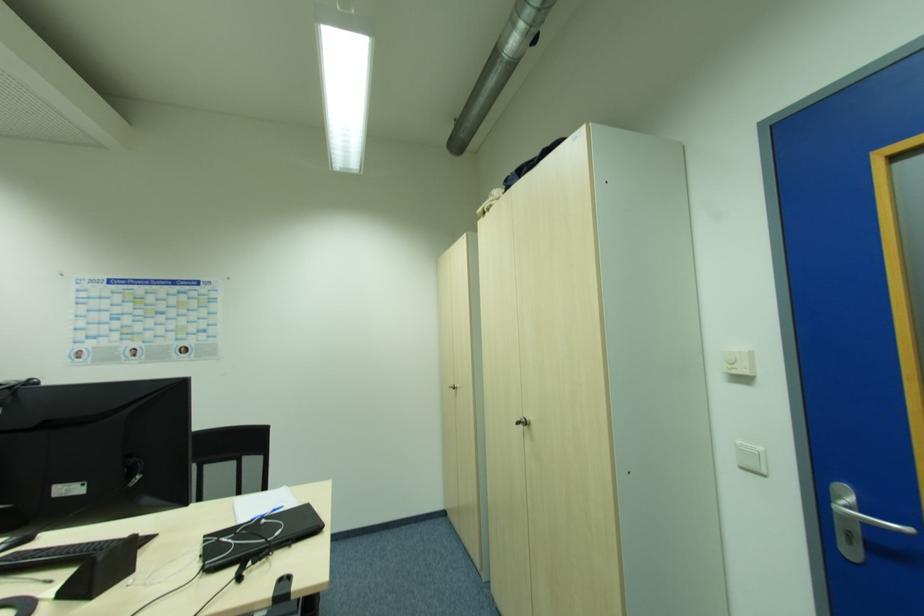
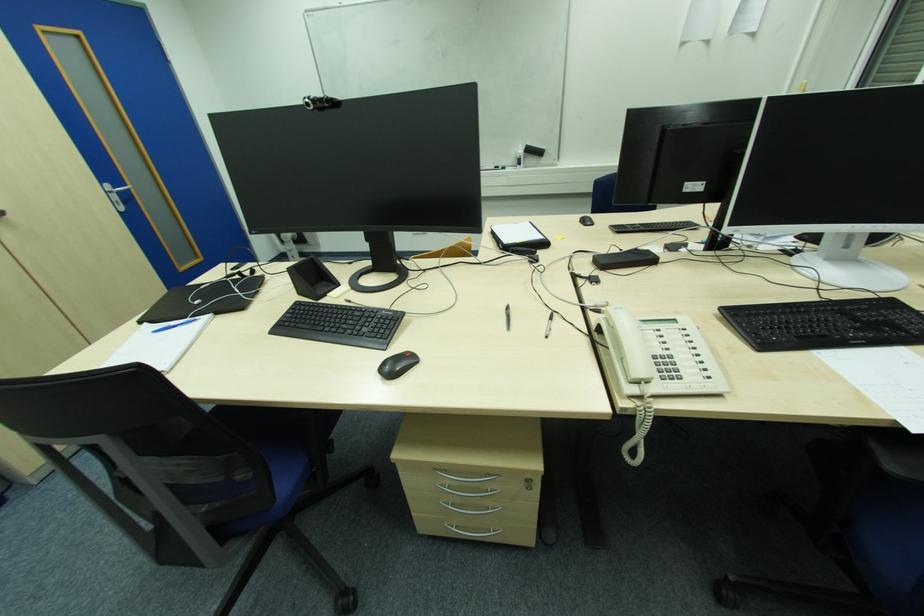
In the second image, find the point that corresponds to the point at 284,508 in the first image.

(156, 333)